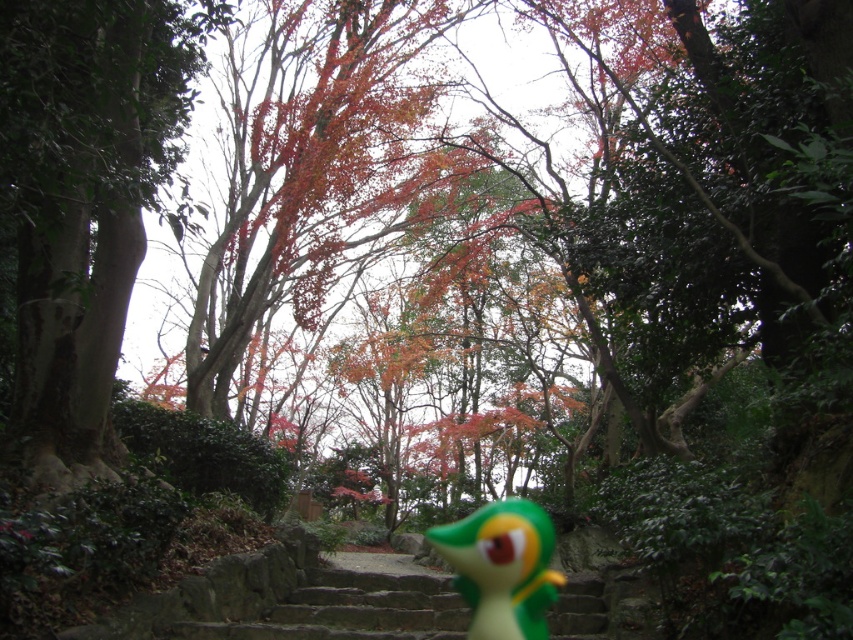
Is green smooth tree trunk at left closer to the viewer compared to green rubber toy at center?

Yes, it is.

Does green smooth tree trunk at left have a lesser width compared to green rubber toy at center?

No.

Is point (53, 282) positioned in front of point (538, 620)?

Yes, it is in front of point (538, 620).

What are the coordinates of `green smooth tree trunk at left` in the screenshot? It's located at (85, 196).